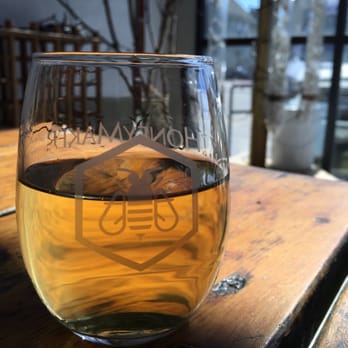
This screenshot has width=348, height=348. Find the location of `wooden table`. wooden table is located at coordinates (283, 265).